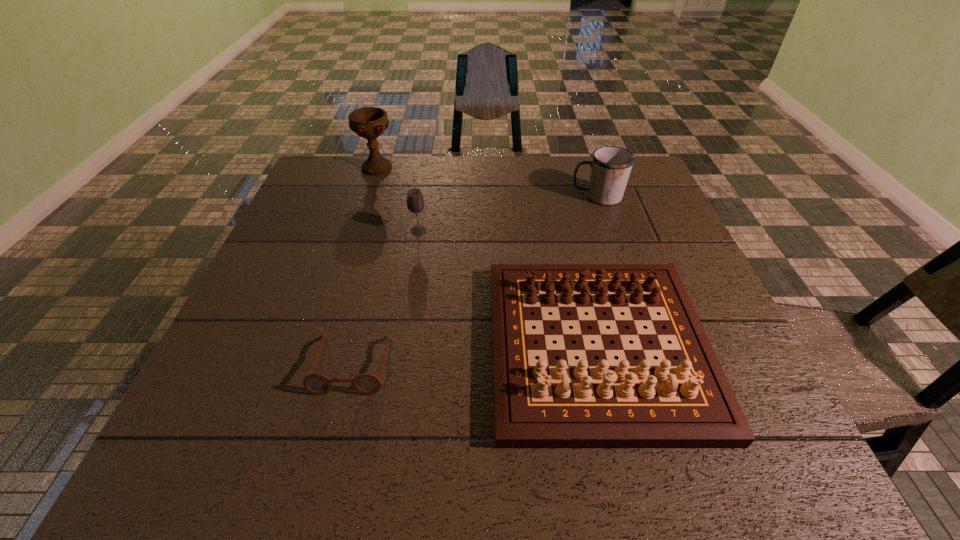
Identify the location of empty location between the third nearest object and the fourth nearest object. (508, 214).

Locate an element on the screen. vacant area that lies between the shortest object and the third nearest object is located at coordinates (386, 298).

Identify the location of vacant space in between the second shortest object and the tallest object. (488, 258).

The height and width of the screenshot is (540, 960). Identify the location of free space between the mug and the spectacles. (475, 280).

This screenshot has width=960, height=540. In order to click on free space between the chalice and the shortest object in this screenshot , I will do pyautogui.click(x=365, y=266).

Where is `empty space that is in between the fourth nearest object and the chalice`? empty space that is in between the fourth nearest object and the chalice is located at coordinates (488, 183).

I want to click on object that ranks as the third closest to the fourth tallest object, so click(610, 167).

You are a GUI agent. You are given a task and a screenshot of the screen. Output one action in this format:
    pyautogui.click(x=<x>, y=<y>)
    Task: Click on the object identified as the fourth closest to the tallest object
    This screenshot has width=960, height=540.
    Given the screenshot: What is the action you would take?
    pyautogui.click(x=365, y=383)

The image size is (960, 540). Find the location of `free point that satisfies the following two spatial constraints: 1. on the handle side of the mug; 2. on the side with the white pieces of the gameboard`. free point that satisfies the following two spatial constraints: 1. on the handle side of the mug; 2. on the side with the white pieces of the gameboard is located at coordinates (648, 347).

In order to click on free location that satisfies the following two spatial constraints: 1. on the handle side of the mug; 2. on the front-facing side of the spectacles in this screenshot , I will do `click(654, 364)`.